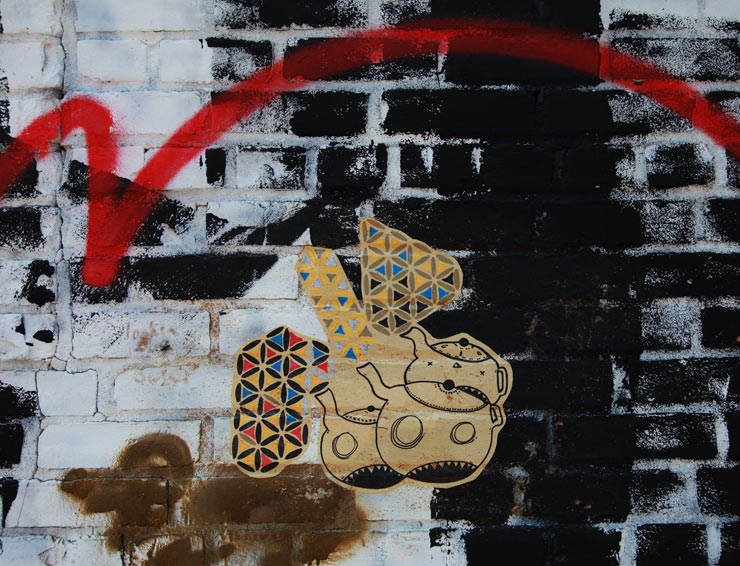
You are a GUI agent. You are given a task and a screenshot of the screen. Output one action in this format:
    pyautogui.click(x=<x>, y=<y>)
    Task: Click on the teapot lids
    This screenshot has width=740, height=566.
    Given the screenshot: What is the action you would take?
    pyautogui.click(x=362, y=414), pyautogui.click(x=426, y=391), pyautogui.click(x=456, y=354)